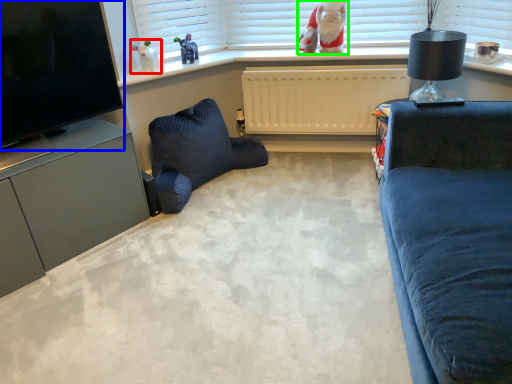
Question: Considering the real-world distances, which object is farthest from toy (highlighted by a red box)? television (highlighted by a blue box) or doll (highlighted by a green box)?

Choices:
 (A) television
 (B) doll

Answer: (B)